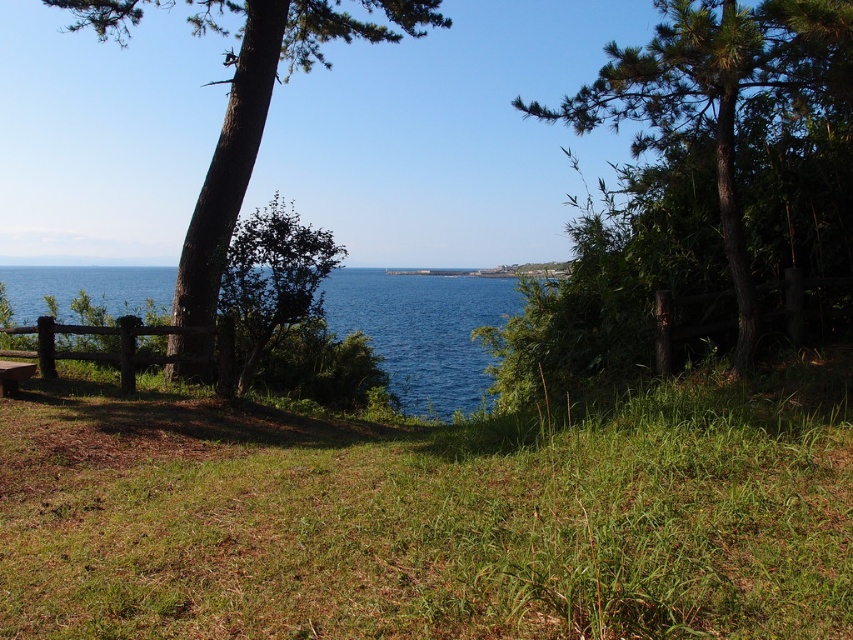
Question: Among these points, which one is farthest from the camera?

Choices:
 (A) (467, 348)
 (B) (685, 58)
 (C) (364, 29)
 (D) (206, 605)

Answer: (A)

Question: Based on their relative distances, which object is farther from the green leafy tree at center?

Choices:
 (A) green grassy at center
 (B) green textured tree at left

Answer: (B)

Question: Among these objects, which one is nearest to the camera?

Choices:
 (A) green textured tree at left
 (B) blue water at center
 (C) green grassy at center

Answer: (C)

Question: Does green textured tree at left appear on the right side of brown wooden bench at lower left?

Choices:
 (A) no
 (B) yes

Answer: (A)

Question: Can you confirm if green textured tree at left is smaller than brown wooden bench at lower left?

Choices:
 (A) yes
 (B) no

Answer: (B)

Question: Where is green textured tree at left located in relation to brown wooden bench at lower left in the image?

Choices:
 (A) below
 (B) above

Answer: (B)